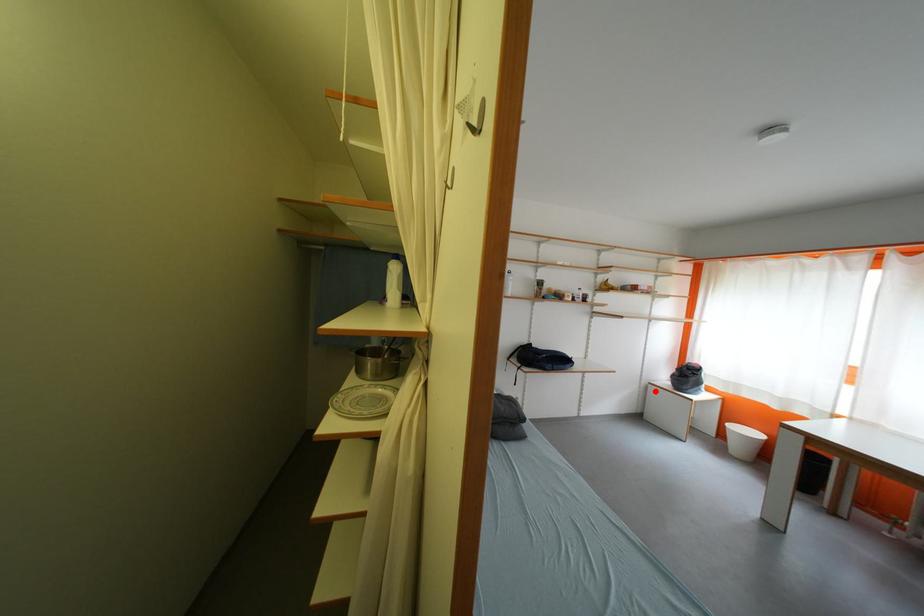
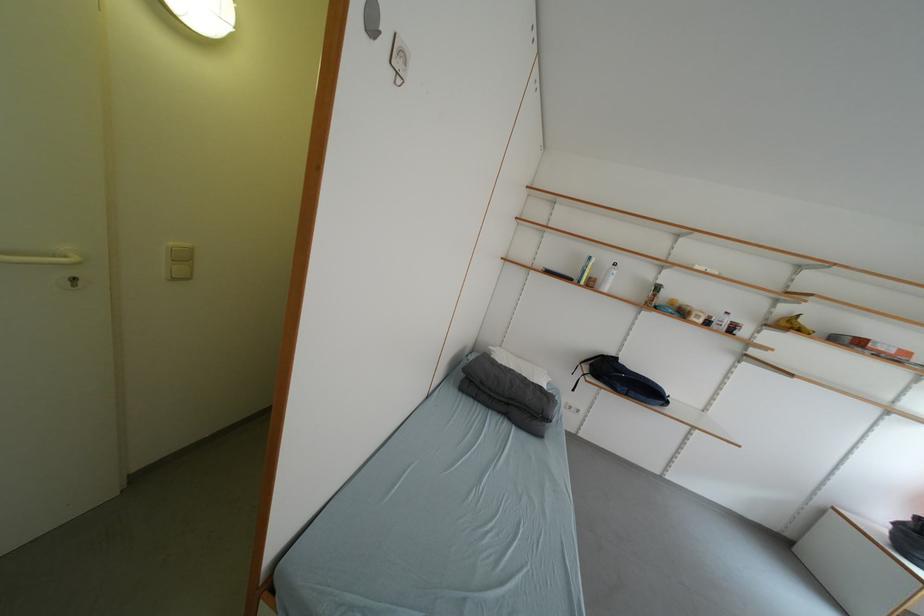
Question: A red point is marked in image1. In image2, is the corresponding 3D point closer to the camera or farther? Reply with the corresponding letter.

Choices:
 (A) The corresponding 3D point is closer.
 (B) The corresponding 3D point is farther.

Answer: (B)